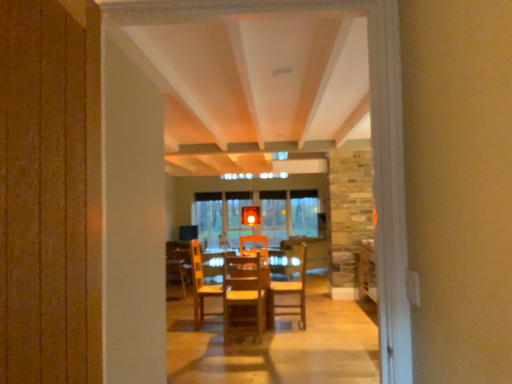
Question: Is wooden table at center not near wooden chairs at center?

Choices:
 (A) yes
 (B) no

Answer: (A)

Question: Does wooden table at center come in front of wooden chairs at center?

Choices:
 (A) yes
 (B) no

Answer: (B)

Question: From a real-world perspective, is wooden table at center beneath wooden chairs at center?

Choices:
 (A) yes
 (B) no

Answer: (B)

Question: Is wooden chairs at center inside wooden table at center?

Choices:
 (A) yes
 (B) no

Answer: (B)

Question: Is wooden table at center positioned with its back to wooden chairs at center?

Choices:
 (A) no
 (B) yes

Answer: (A)

Question: From the image's perspective, is wooden chairs at center positioned above or below wooden table at center?

Choices:
 (A) above
 (B) below

Answer: (B)

Question: Relative to wooden table at center, is wooden chairs at center in front or behind?

Choices:
 (A) front
 (B) behind

Answer: (A)

Question: Considering the relative positions of wooden chairs at center and wooden table at center in the image provided, is wooden chairs at center to the left or to the right of wooden table at center?

Choices:
 (A) right
 (B) left

Answer: (A)

Question: From their relative heights in the image, would you say wooden chairs at center is taller or shorter than wooden table at center?

Choices:
 (A) tall
 (B) short

Answer: (B)

Question: Is wooden chair at center, the first chair positioned from the right, to the left or to the right of wooden chair at center, which appears as the first chair when viewed from the left, in the image?

Choices:
 (A) right
 (B) left

Answer: (A)

Question: From a real-world perspective, is wooden chair at center, the 2th chair positioned from the front, physically located above or below wooden chair at center, which ranks as the 2th chair in back-to-front order?

Choices:
 (A) below
 (B) above

Answer: (A)

Question: In terms of size, does wooden chair at center, the first chair positioned from the right, appear bigger or smaller than wooden chair at center, which appears as the first chair when viewed from the left?

Choices:
 (A) small
 (B) big

Answer: (A)

Question: Considering their positions, is wooden chair at center, the second chair from the left, located in front of or behind wooden chair at center, the 2th chair positioned from the right?

Choices:
 (A) front
 (B) behind

Answer: (B)

Question: Considering the positions of wooden chair at center, which ranks as the 2th chair in back-to-front order, and wooden chairs at center in the image, is wooden chair at center, which ranks as the 2th chair in back-to-front order, bigger or smaller than wooden chairs at center?

Choices:
 (A) big
 (B) small

Answer: (B)

Question: Relative to wooden chairs at center, is wooden chair at center, which is counted as the first chair, starting from the front, in front or behind?

Choices:
 (A) behind
 (B) front

Answer: (A)